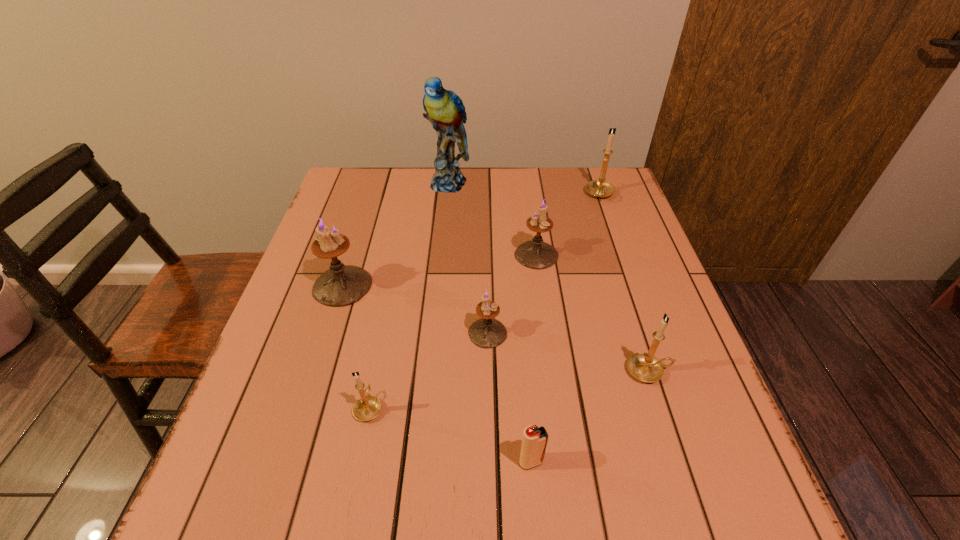
You are a GUI agent. You are given a task and a screenshot of the screen. Output one action in this format:
    pyautogui.click(x=<x>, y=<y>)
    Task: Click on the purple candle holder that is the closest one to the second farthest gold candle holder
    
    Given the screenshot: What is the action you would take?
    pyautogui.click(x=487, y=332)

The image size is (960, 540). Identify the location of vacant position in the image that satisfies the following two spatial constraints: 1. on the handle side of the second purple candle holder from right to left; 2. on the right side of the leftmost gold candle holder. (383, 333).

In order to click on free space in the image that satisfies the following two spatial constraints: 1. on the back side of the second biggest purple candle holder; 2. on the left side of the fourth farthest candle holder in this screenshot , I will do `click(487, 255)`.

In order to click on free space that satisfies the following two spatial constraints: 1. on the face of the igniter; 2. on the right side of the tallest object in this screenshot , I will do `click(421, 462)`.